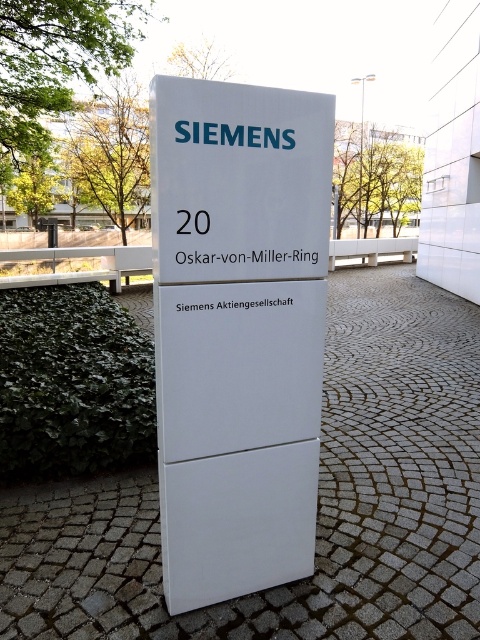
Question: Which object is closer to the camera taking this photo?

Choices:
 (A) white matte sign at center
 (B) white plastic sign at center

Answer: (B)

Question: Can you confirm if white matte sign at center is thinner than white plastic sign at center?

Choices:
 (A) yes
 (B) no

Answer: (B)

Question: Which of the following is the closest to the observer?

Choices:
 (A) white matte sign at center
 (B) white plastic sign at center

Answer: (B)

Question: Does white matte sign at center appear on the left side of white plastic sign at center?

Choices:
 (A) yes
 (B) no

Answer: (A)

Question: Is white matte sign at center above white plastic sign at center?

Choices:
 (A) yes
 (B) no

Answer: (B)